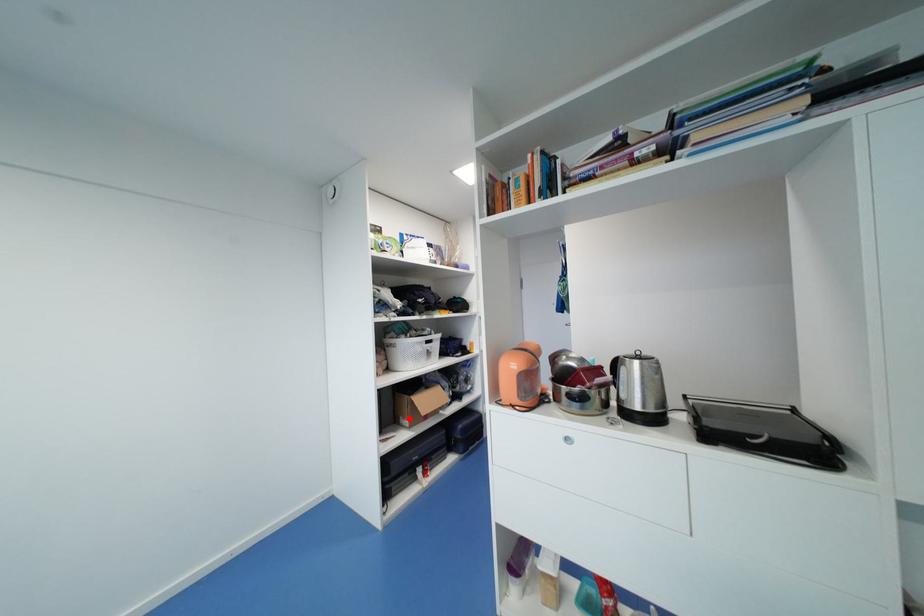
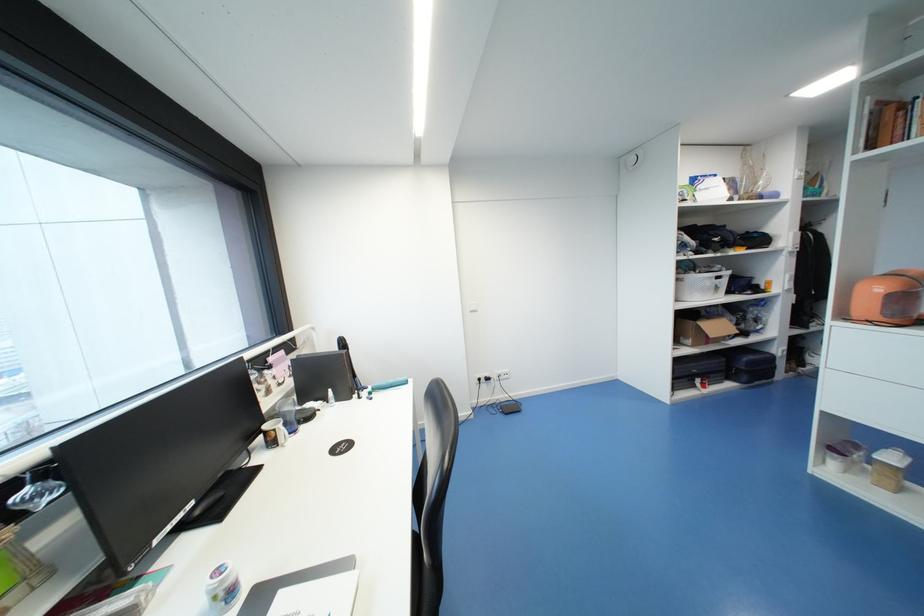
Question: I am providing you with two images of the same scene from different viewpoints. Given a red point in image1, look at the same physical point in image2. Is it:

Choices:
 (A) Closer to the viewpoint
 (B) Farther from the viewpoint

Answer: (A)